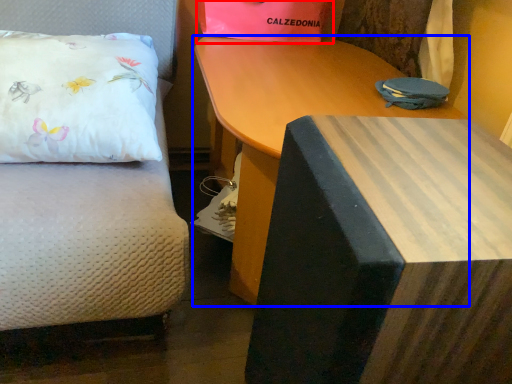
Question: Which point is further to the camera, gift bag (highlighted by a red box) or table (highlighted by a blue box)?

Choices:
 (A) gift bag
 (B) table

Answer: (A)